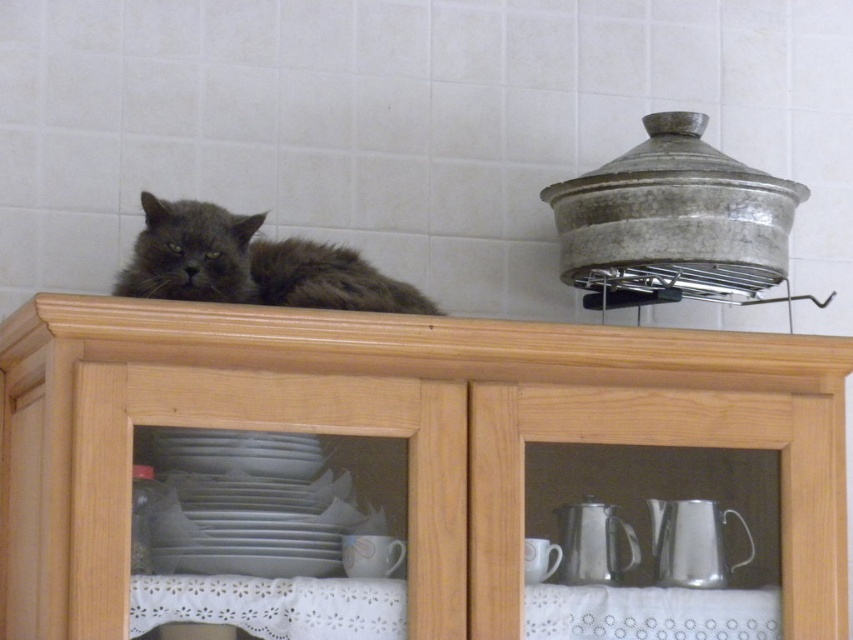
Question: Does wooden cabinet at center have a smaller size compared to brushed metal tea pot at lower center?

Choices:
 (A) yes
 (B) no

Answer: (B)

Question: Observing the image, what is the correct spatial positioning of wooden cabinet at center in reference to fuzzy gray cat at upper center?

Choices:
 (A) right
 (B) left

Answer: (A)

Question: Among these points, which one is nearest to the camera?

Choices:
 (A) (691, 536)
 (B) (305, 257)
 (C) (308, 324)
 (D) (579, 513)

Answer: (C)

Question: Estimate the real-world distances between objects in this image. Which object is farther from the brushed metal tea pot at lower center?

Choices:
 (A) wooden cabinet at center
 (B) fuzzy gray cat at upper center

Answer: (B)

Question: Can you confirm if wooden cabinet at center is wider than fuzzy gray cat at upper center?

Choices:
 (A) yes
 (B) no

Answer: (A)

Question: Considering the real-world distances, which object is farthest from the brushed metal tea pot at lower center?

Choices:
 (A) silver metallic teapot at lower right
 (B) wooden cabinet at center
 (C) fuzzy gray cat at upper center

Answer: (C)